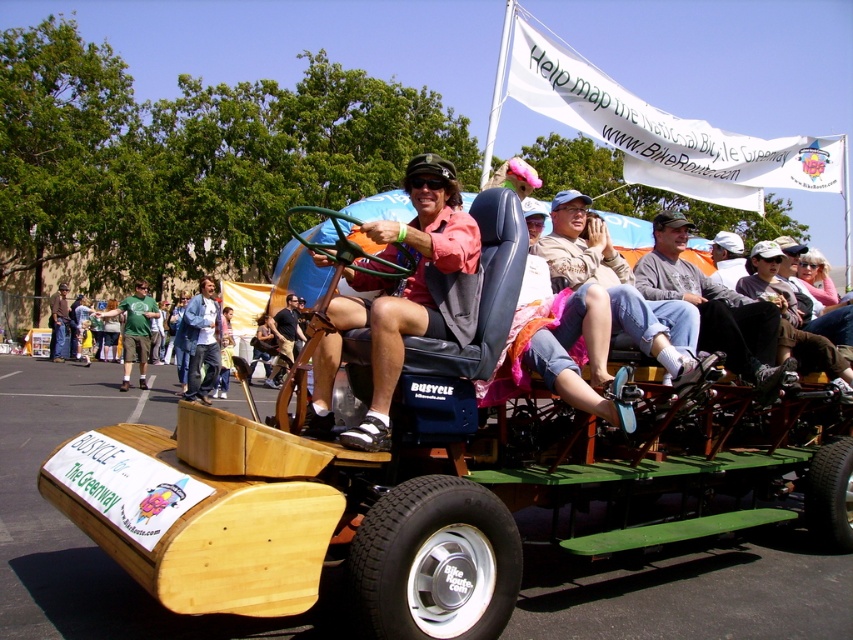
You are a photographer at the event and want to capture a photo of the denim jacket at center and the matte pink shirt at center. From the perspective of the photographer facing the scene, which object should you adjust your camera to focus on first if you want to capture the one that is farther to the left?

The denim jacket at center is farther to the left, so you should focus on the denim jacket at center first.

You are a photographer at the community event and want to take a photo of the two people wearing the gray cotton shirt at center and denim jacket at center. Which one is standing to the right of the other?

The gray cotton shirt at center is positioned on the right side of denim jacket at center, so the person wearing the gray cotton shirt at center is standing to the right of the person wearing the denim jacket at center.